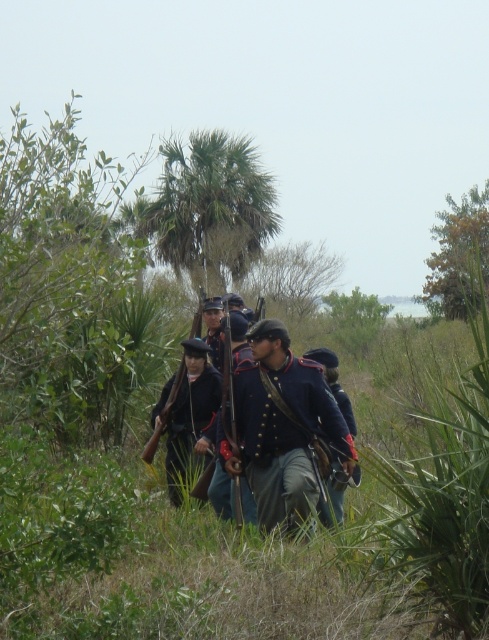
From the picture: You are a photographer trying to capture a clear shot of the blue wool uniform at center without the green leafy palm tree at center blocking the view. Can you adjust your position to achieve this?

The green leafy palm tree at center is located above the blue wool uniform at center, so if you lower your camera angle or move to a position where the palm tree is no longer directly overhead, you can capture the blue wool uniform at center without obstruction.

You are a photographer positioned at the origin point in the scene. You want to capture a photo of the green leafy palm tree at center. According to the coordinates provided, in which direction should you move to frame the palm tree properly?

The green leafy palm tree at center is located at point [210,208], so you should move towards the coordinates [210,208] to frame the palm tree properly.

You are a photographer observing the soldiers in the scene. You need to capture a clear photo of both the blue uniformed soldiers at center and the dark blue wool uniform at center. Which of the two should you focus on to ensure it appears larger in your photo?

The blue uniformed soldiers at center is larger in size than the dark blue wool uniform at center, so focusing on the blue uniformed soldiers at center will ensure it appears larger in the photo.